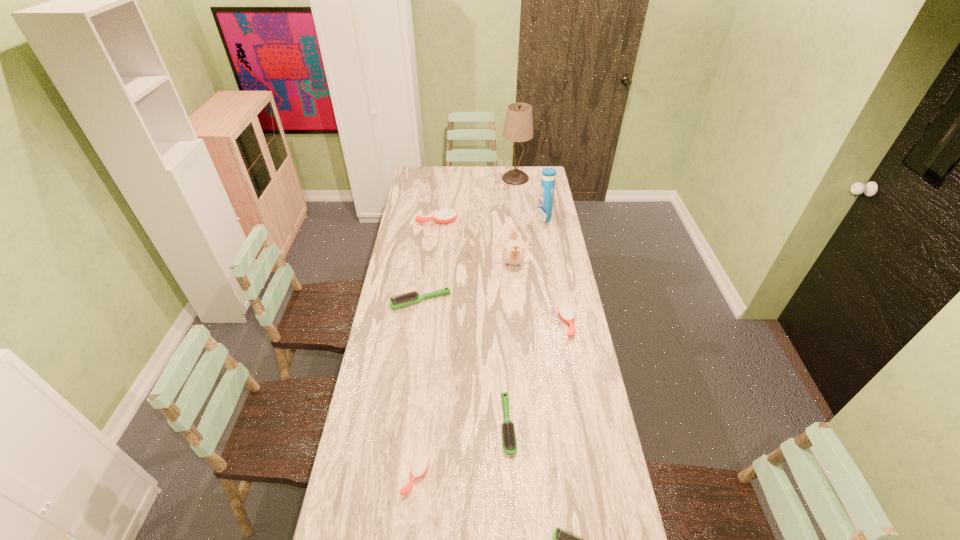
The height and width of the screenshot is (540, 960). What are the coordinates of `lampshade` in the screenshot? It's located at (518, 127).

Where is `the tallest object`? The height and width of the screenshot is (540, 960). the tallest object is located at coordinates (518, 127).

Find the location of a particular element. The width and height of the screenshot is (960, 540). detergent is located at coordinates (545, 202).

Where is `the sixth nearest object`? The height and width of the screenshot is (540, 960). the sixth nearest object is located at coordinates (513, 252).

In order to click on white bird in this screenshot , I will do `click(513, 252)`.

The height and width of the screenshot is (540, 960). I want to click on the tallest hairbrush, so click(446, 215).

I want to click on the sixth shortest object, so click(x=446, y=215).

Identify the location of the rightmost orange hairbrush. The width and height of the screenshot is (960, 540). (566, 312).

Locate an element on the screen. This screenshot has width=960, height=540. the second farthest orange hairbrush is located at coordinates (566, 312).

Identify the location of the farthest light hairbrush. Image resolution: width=960 pixels, height=540 pixels. (410, 298).